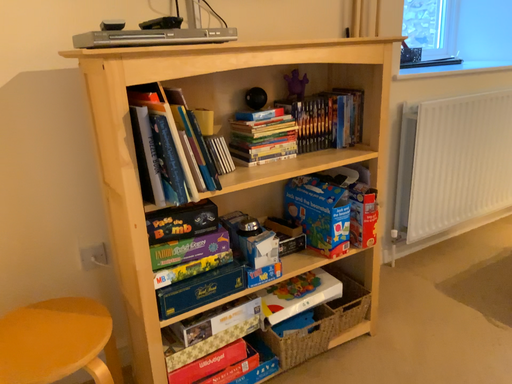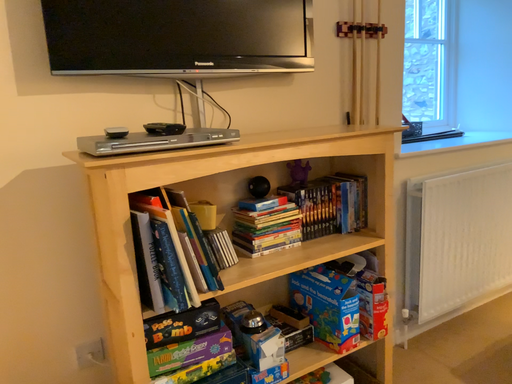
Question: How did the camera likely rotate when shooting the video?

Choices:
 (A) rotated downward
 (B) rotated upward

Answer: (B)